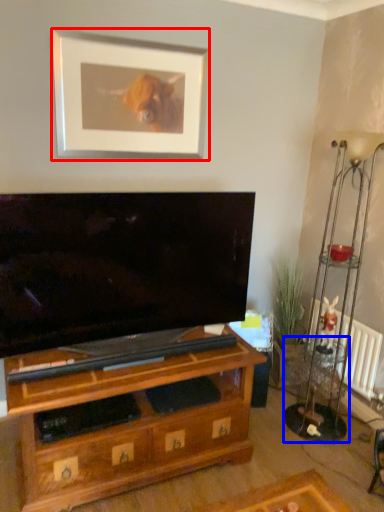
Question: Which object is closer to the camera taking this photo, picture frame (highlighted by a red box) or side table (highlighted by a blue box)?

Choices:
 (A) picture frame
 (B) side table

Answer: (A)